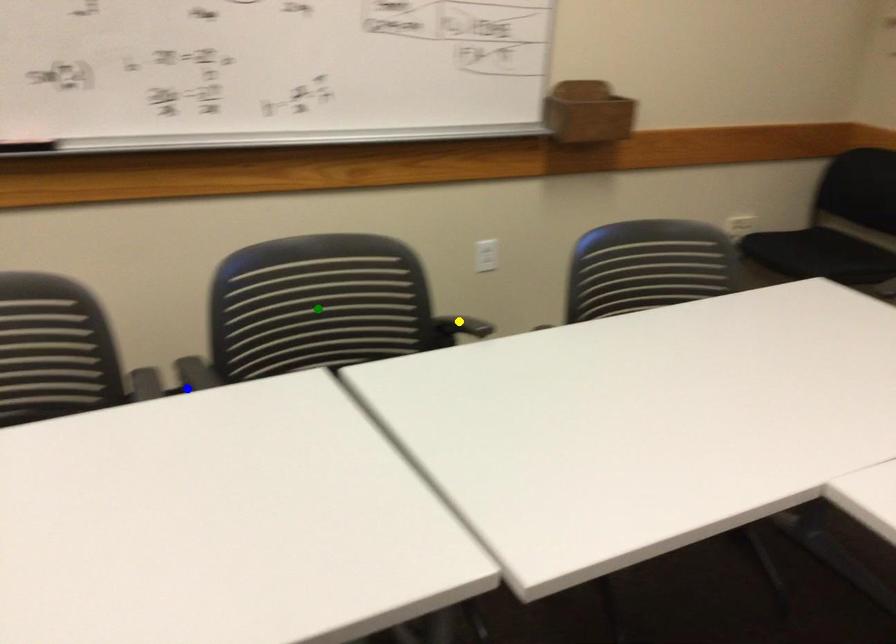
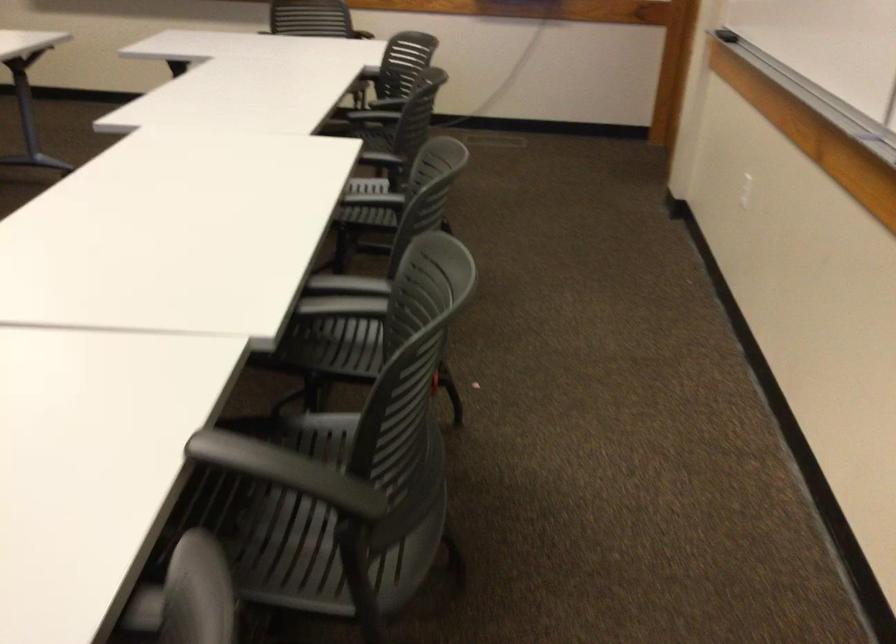
I am providing you with two images of the same scene from different viewpoints. Three points are marked in image1. Which point corresponds to a part or object that is occluded in image2?In image1, three points are marked. Which of them correspond to a part or object that is occluded in image2?Among the three points shown in image1, which one corresponds to a part or object that is no longer visible due to occlusion in image2?

green point